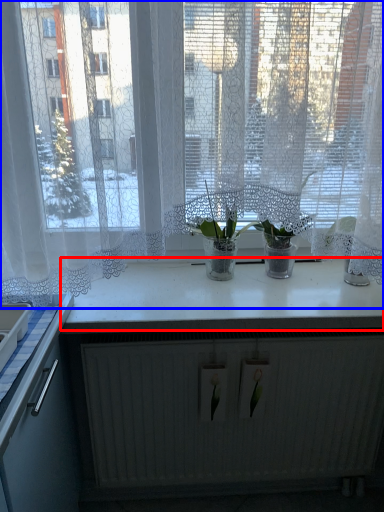
Question: Which object is closer to the camera taking this photo, counter top (highlighted by a red box) or window (highlighted by a blue box)?

Choices:
 (A) counter top
 (B) window

Answer: (B)